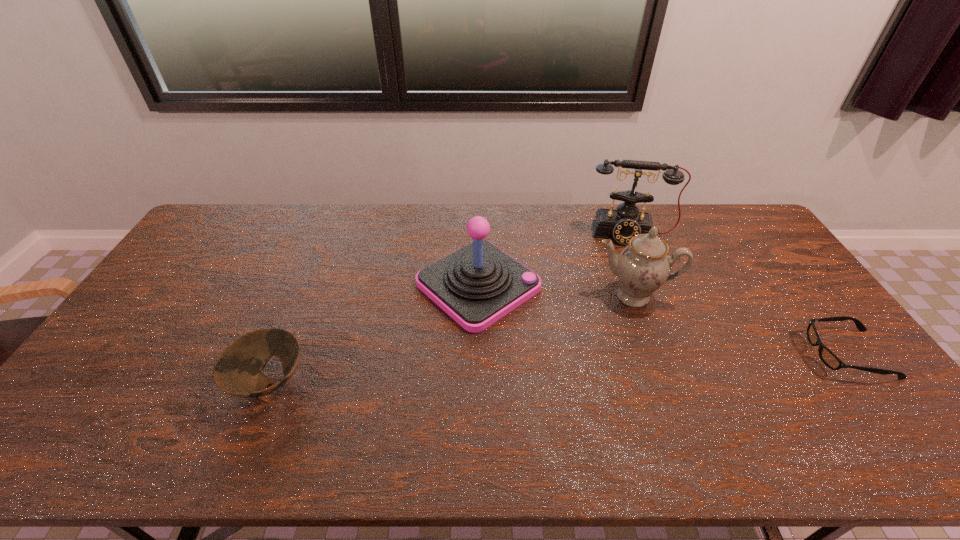
Locate an element on the screen. This screenshot has height=540, width=960. vacant area between the shortest object and the telephone is located at coordinates (738, 294).

You are a GUI agent. You are given a task and a screenshot of the screen. Output one action in this format:
    pyautogui.click(x=<x>, y=<y>)
    Task: Click on the vacant space in between the spectacles and the chinaware
    
    Given the screenshot: What is the action you would take?
    pyautogui.click(x=740, y=325)

I want to click on free point between the second shortest object and the joystick, so click(x=374, y=334).

Find the location of `free spot between the rightmost object and the chinaware`. free spot between the rightmost object and the chinaware is located at coordinates (740, 325).

What are the coordinates of `vacant region between the shortest object and the second object from left to right` in the screenshot? It's located at (662, 319).

In order to click on free space between the chinaware and the second shortest object in this screenshot , I will do `click(451, 339)`.

You are a GUI agent. You are given a task and a screenshot of the screen. Output one action in this format:
    pyautogui.click(x=<x>, y=<y>)
    Task: Click on the third closest object to the chinaware
    The image size is (960, 540).
    Given the screenshot: What is the action you would take?
    pyautogui.click(x=826, y=355)

Locate which object ranks in proximity to the telephone. Please provide its 2D coordinates. Your answer should be formatted as a tuple, i.e. [(x, y)], where the tuple contains the x and y coordinates of a point satisfying the conditions above.

[(642, 266)]

In order to click on vacant space that satisfies the following two spatial constraints: 1. on the front side of the telephone; 2. on the front-facing side of the spectacles in this screenshot , I will do `click(677, 354)`.

Locate an element on the screen. This screenshot has height=540, width=960. vacant area that satisfies the following two spatial constraints: 1. on the front side of the spectacles; 2. on the front-facing side of the telephone is located at coordinates pos(677,354).